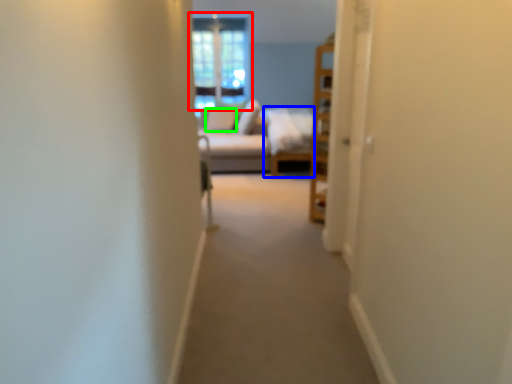
Question: Considering the real-world distances, which object is farthest from window (highlighted by a red box)? couch (highlighted by a blue box) or pillow (highlighted by a green box)?

Choices:
 (A) couch
 (B) pillow

Answer: (A)